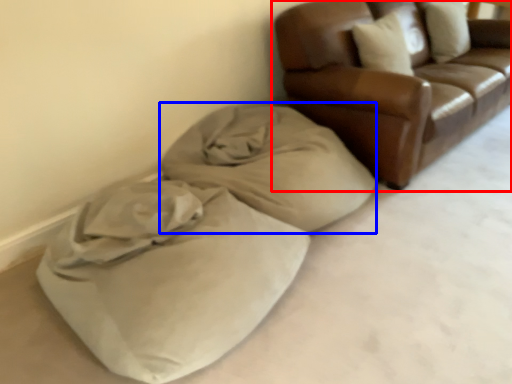
Question: Which object appears farthest to the camera in this image, studio couch (highlighted by a red box) or blanket (highlighted by a blue box)?

Choices:
 (A) studio couch
 (B) blanket

Answer: (A)